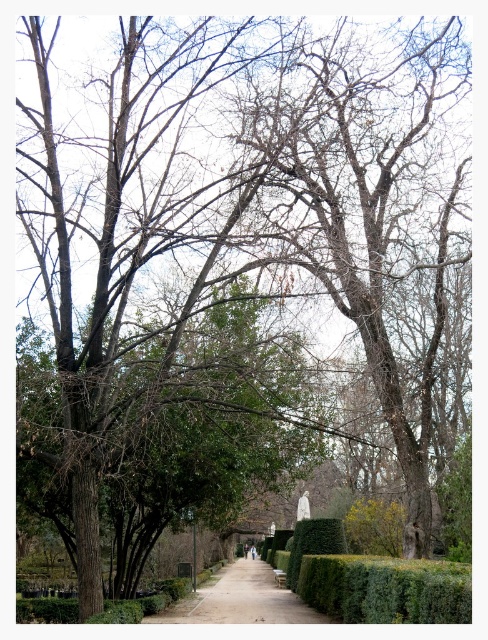
You are planning to walk along the garden pathway and want to know if there is enough space between the green leafy hedge at center and the paved stone path at center to place a 2m wide bench. Can you determine if it will fit?

The green leafy hedge at center is narrower than the paved stone path at center. However, the exact width of the space between them isn

You are standing at the starting point of the garden pathway and see two points marked on the path. The first point is at coordinate point(431, 595) and the second point is at coordinate point(245, 612). Which of these two points is closer to you as you walk along the path?

Point(431, 595) is in front of point(245, 612), so the first point is closer to you as you walk along the path.

You are standing at the point labeled as point (386, 589) in the garden scene. Based on the description provided, what is the immediate object or feature directly beneath this coordinate?

The point (386, 589) is on the green leafy hedge at center.